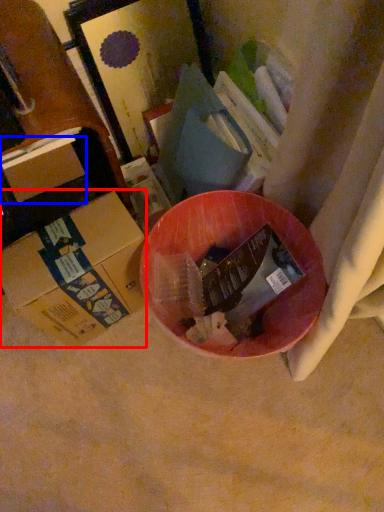
Question: Which object is closer to the camera taking this photo, box (highlighted by a red box) or box (highlighted by a blue box)?

Choices:
 (A) box
 (B) box

Answer: (A)